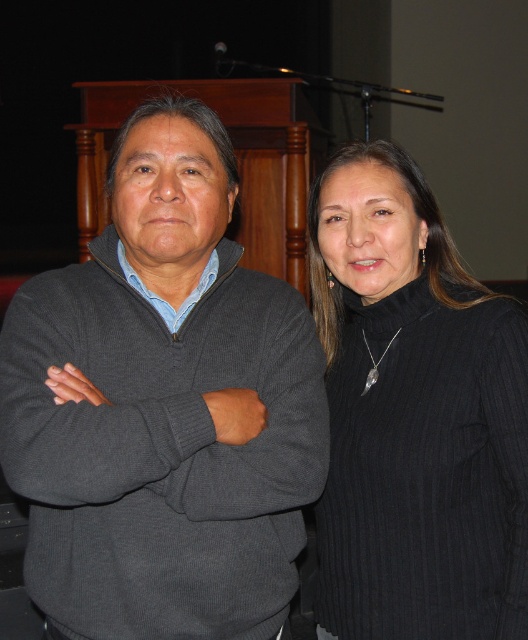
Question: Is the position of dark gray sweater at center more distant than that of black ribbed sweater at right?

Choices:
 (A) yes
 (B) no

Answer: (B)

Question: Is dark gray sweater at center above black ribbed sweater at right?

Choices:
 (A) yes
 (B) no

Answer: (A)

Question: Can you confirm if dark gray sweater at center is bigger than black ribbed sweater at right?

Choices:
 (A) no
 (B) yes

Answer: (B)

Question: Which object is farther from the camera taking this photo?

Choices:
 (A) dark gray sweater at center
 (B) black ribbed sweater at right

Answer: (B)

Question: Among these points, which one is farthest from the camera?

Choices:
 (A) (188, 337)
 (B) (483, 531)

Answer: (B)